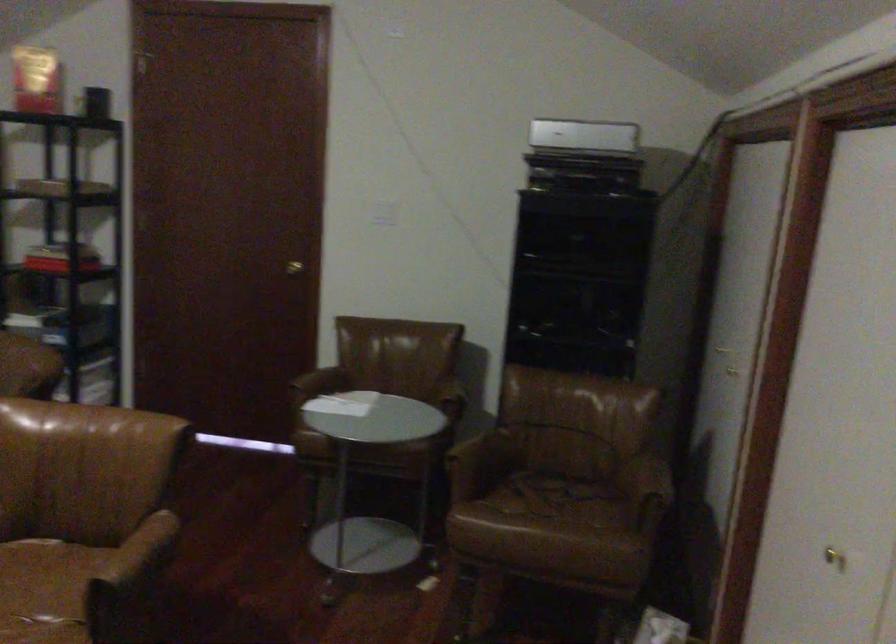
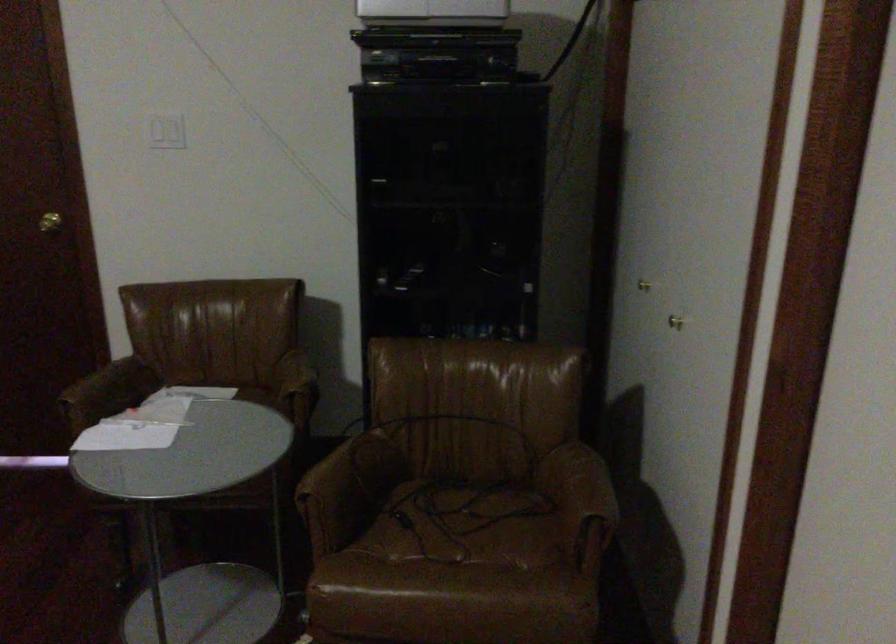
Question: The camera is either moving clockwise (left) or counter-clockwise (right) around the object. The first image is from the beginning of the video and the second image is from the end. Is the camera moving left or right when shooting the video?

Choices:
 (A) Left
 (B) Right

Answer: (A)